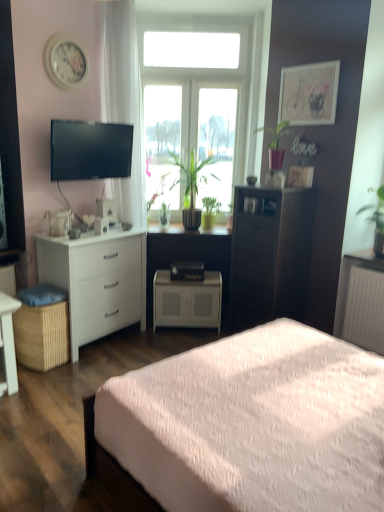
Question: Is green matte plant at center, placed as the fifth houseplant when sorted from right to left, inside white glossy clock at upper left?

Choices:
 (A) yes
 (B) no

Answer: (B)

Question: Can you confirm if white glossy clock at upper left is thinner than green matte plant at center, the first houseplant in the left-to-right sequence?

Choices:
 (A) no
 (B) yes

Answer: (B)

Question: From a real-world perspective, does white glossy clock at upper left sit lower than green matte plant at center, the first houseplant in the left-to-right sequence?

Choices:
 (A) yes
 (B) no

Answer: (B)

Question: Is the depth of white glossy clock at upper left less than that of green matte plant at center, the first houseplant in the left-to-right sequence?

Choices:
 (A) no
 (B) yes

Answer: (B)

Question: Is white glossy clock at upper left taller than green matte plant at center, the first houseplant in the left-to-right sequence?

Choices:
 (A) yes
 (B) no

Answer: (B)

Question: Considering the relative positions of white matte cabinet at center and transparent glass window at center in the image provided, is white matte cabinet at center to the left or to the right of transparent glass window at center?

Choices:
 (A) right
 (B) left

Answer: (B)

Question: From the image's perspective, is white matte cabinet at center positioned above or below transparent glass window at center?

Choices:
 (A) above
 (B) below

Answer: (B)

Question: In the image, is white matte cabinet at center positioned in front of or behind transparent glass window at center?

Choices:
 (A) behind
 (B) front

Answer: (A)

Question: Which is correct: white matte cabinet at center is inside transparent glass window at center, or outside of it?

Choices:
 (A) inside
 (B) outside

Answer: (B)

Question: Looking at their shapes, would you say white metallic radiator at lower right is wider or thinner than transparent glass window at center?

Choices:
 (A) thin
 (B) wide

Answer: (B)

Question: Do you think white metallic radiator at lower right is within transparent glass window at center, or outside of it?

Choices:
 (A) outside
 (B) inside

Answer: (A)

Question: From the image's perspective, relative to transparent glass window at center, is white metallic radiator at lower right above or below?

Choices:
 (A) below
 (B) above

Answer: (A)

Question: Is white metallic radiator at lower right taller or shorter than transparent glass window at center?

Choices:
 (A) tall
 (B) short

Answer: (B)

Question: Choose the correct answer: Is white glossy desk at lower left inside white matte cabinet at center or outside it?

Choices:
 (A) inside
 (B) outside

Answer: (B)

Question: Is white glossy desk at lower left in front of or behind white matte cabinet at center in the image?

Choices:
 (A) front
 (B) behind

Answer: (A)